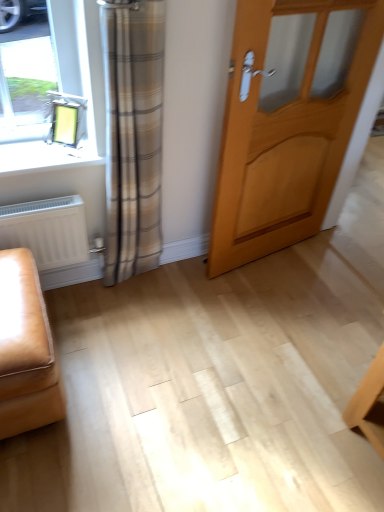
At what (x,y) coordinates should I click in order to perform the action: click on free space above leather ottoman at lower left (from a real-world perspective). Please return your answer as a coordinate pair (x, y). Looking at the image, I should click on (14, 297).